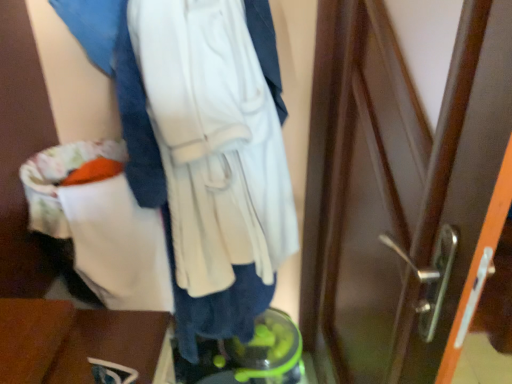
What is the approximate width of wooden table at lower left?

14.73 inches.

Describe the element at coordinates (74, 341) in the screenshot. The image size is (512, 384). I see `wooden table at lower left` at that location.

Locate an element on the screen. This screenshot has width=512, height=384. wooden table at lower left is located at coordinates (74, 341).

The height and width of the screenshot is (384, 512). What do you see at coordinates (214, 140) in the screenshot?
I see `white soft sweatshirt at center` at bounding box center [214, 140].

You are a GUI agent. You are given a task and a screenshot of the screen. Output one action in this format:
    pyautogui.click(x=<x>, y=<y>)
    Task: Click on the white soft sweatshirt at center
    The image size is (512, 384).
    Given the screenshot: What is the action you would take?
    pyautogui.click(x=214, y=140)

The image size is (512, 384). Find the location of `wooden table at lower left`. wooden table at lower left is located at coordinates (74, 341).

Considering the relative positions of white soft sweatshirt at center and wooden table at lower left in the image provided, is white soft sweatshirt at center to the left or to the right of wooden table at lower left?

Clearly, white soft sweatshirt at center is on the right of wooden table at lower left in the image.

Is white soft sweatshirt at center further to the viewer compared to wooden table at lower left?

No, white soft sweatshirt at center is closer to the camera.

Which is nearer, [170,162] or [82,341]?

Point [170,162].

From the image's perspective, is white soft sweatshirt at center located beneath wooden table at lower left?

Incorrect, from the image's perspective, white soft sweatshirt at center is higher than wooden table at lower left.

From a real-world perspective, which is physically below, white soft sweatshirt at center or wooden table at lower left?

wooden table at lower left is physically lower.

Which of these two, white soft sweatshirt at center or wooden table at lower left, is thinner?

With smaller width is white soft sweatshirt at center.

From their relative heights in the image, would you say white soft sweatshirt at center is taller or shorter than wooden table at lower left?

In the image, white soft sweatshirt at center appears to be taller than wooden table at lower left.

Does white soft sweatshirt at center have a smaller size compared to wooden table at lower left?

Actually, white soft sweatshirt at center might be larger than wooden table at lower left.

Choose the correct answer: Is white soft sweatshirt at center inside wooden table at lower left or outside it?

white soft sweatshirt at center is not enclosed by wooden table at lower left.

Is white soft sweatshirt at center far from wooden table at lower left?

That's not correct — white soft sweatshirt at center is a little close to wooden table at lower left.

Could you tell me if white soft sweatshirt at center is turned towards wooden table at lower left?

Yes.

Based on the photo, can you tell me how much white soft sweatshirt at center and wooden table at lower left differ in facing direction?

white soft sweatshirt at center and wooden table at lower left are facing 90.6 degrees away from each other.

The image size is (512, 384). What are the coordinates of `furniture that appears on the left of white soft sweatshirt at center` in the screenshot? It's located at (74, 341).

Considering the positions of objects wooden table at lower left and white soft sweatshirt at center in the image provided, who is more to the left, wooden table at lower left or white soft sweatshirt at center?

wooden table at lower left.

Considering the positions of objects wooden table at lower left and white soft sweatshirt at center in the image provided, who is in front, wooden table at lower left or white soft sweatshirt at center?

white soft sweatshirt at center is closer to the camera.

Considering the positions of point (118, 333) and point (186, 260), is point (118, 333) closer or farther from the camera than point (186, 260)?

Point (118, 333).

From the image's perspective, is wooden table at lower left located above or below white soft sweatshirt at center?

wooden table at lower left is situated lower than white soft sweatshirt at center in the image.

From a real-world perspective, is wooden table at lower left under white soft sweatshirt at center?

Yes, from a real-world perspective, wooden table at lower left is below white soft sweatshirt at center.

Considering the relative sizes of wooden table at lower left and white soft sweatshirt at center in the image provided, is wooden table at lower left wider than white soft sweatshirt at center?

Indeed, wooden table at lower left has a greater width compared to white soft sweatshirt at center.

Is wooden table at lower left taller or shorter than white soft sweatshirt at center?

In the image, wooden table at lower left appears to be shorter than white soft sweatshirt at center.

Based on the photo, based on their sizes in the image, would you say wooden table at lower left is bigger or smaller than white soft sweatshirt at center?

Clearly, wooden table at lower left is smaller in size than white soft sweatshirt at center.

Is wooden table at lower left not within white soft sweatshirt at center?

That's correct, wooden table at lower left is outside of white soft sweatshirt at center.

Does wooden table at lower left touch white soft sweatshirt at center?

No, wooden table at lower left is not touching white soft sweatshirt at center.

From the picture: Does wooden table at lower left turn towards white soft sweatshirt at center?

No, wooden table at lower left is not facing towards white soft sweatshirt at center.

This screenshot has height=384, width=512. Find the location of `sweatshirt that appears above the wooden table at lower left (from a real-world perspective)`. sweatshirt that appears above the wooden table at lower left (from a real-world perspective) is located at coordinates (214, 140).

In order to click on furniture below the white soft sweatshirt at center (from the image's perspective) in this screenshot , I will do `click(74, 341)`.

Where is `sweatshirt on the right of wooden table at lower left`? The height and width of the screenshot is (384, 512). sweatshirt on the right of wooden table at lower left is located at coordinates (214, 140).